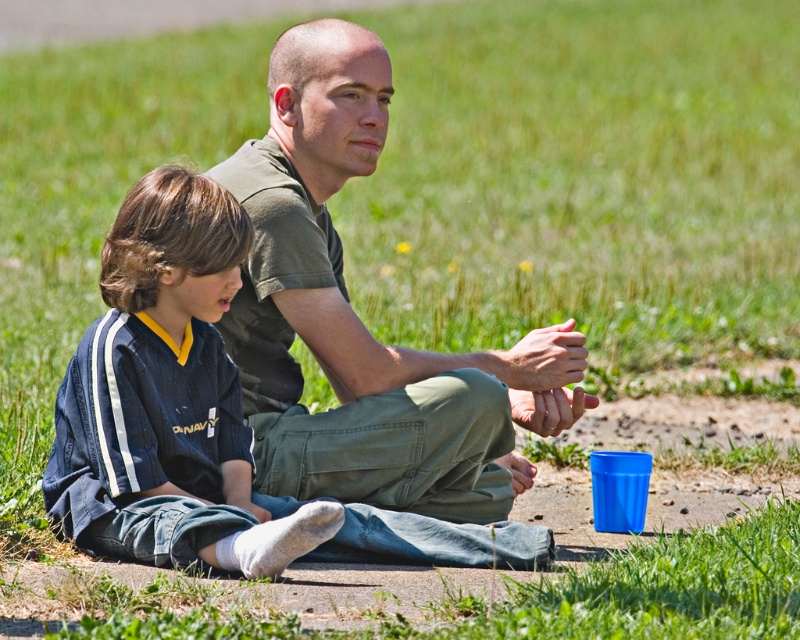
Between matte green t-shirt at center and dark blue jersey at center, which one appears on the right side from the viewer's perspective?

Positioned to the right is matte green t-shirt at center.

Between point (312, 100) and point (134, 339), which one is positioned in front?

Point (134, 339)

Does point (354, 76) come closer to viewer compared to point (162, 499)?

No, it is not.

The width and height of the screenshot is (800, 640). I want to click on matte green t-shirt at center, so (360, 321).